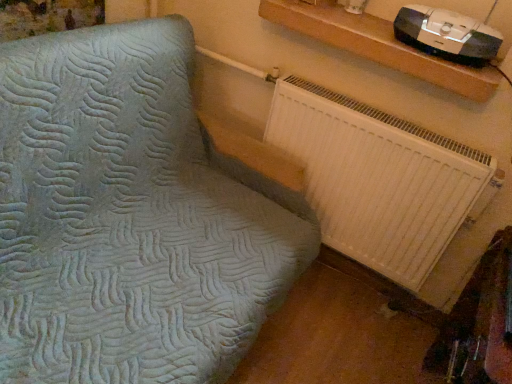
The width and height of the screenshot is (512, 384). What are the coordinates of `white plastic radiator at lower right` in the screenshot? It's located at tap(378, 179).

Locate an element on the screen. black plastic stereo at upper right is located at coordinates (447, 35).

Find the location of `white plastic radiator at lower right`. white plastic radiator at lower right is located at coordinates 378,179.

From a real-world perspective, is black plastic stereo at upper right positioned under wooden shelf at upper right based on gravity?

No, from a real-world perspective, black plastic stereo at upper right is not beneath wooden shelf at upper right.

Based on the photo, does black plastic stereo at upper right have a smaller size compared to wooden shelf at upper right?

Yes, black plastic stereo at upper right is smaller than wooden shelf at upper right.

Can you confirm if black plastic stereo at upper right is thinner than wooden shelf at upper right?

Indeed, black plastic stereo at upper right has a lesser width compared to wooden shelf at upper right.

Consider the image. Can you tell me how much black plastic stereo at upper right and wooden shelf at upper right differ in facing direction?

0.287 degrees.

The height and width of the screenshot is (384, 512). I want to click on stereo on the right side of wooden shelf at upper right, so click(447, 35).

Is point (305, 10) closer or farther from the camera than point (432, 35)?

Point (305, 10) is farther from the camera than point (432, 35).

From a real-world perspective, does wooden shelf at upper right sit lower than black plastic stereo at upper right?

Yes, from a real-world perspective, wooden shelf at upper right is beneath black plastic stereo at upper right.

Which is farther, (410, 37) or (382, 158)?

Positioned behind is point (382, 158).

At what (x,y) coordinates should I click in order to perform the action: click on radiator on the left of black plastic stereo at upper right. Please return your answer as a coordinate pair (x, y). The height and width of the screenshot is (384, 512). Looking at the image, I should click on (378, 179).

Does black plastic stereo at upper right appear on the right side of white plastic radiator at lower right?

Yes.

From the image's perspective, which is above, black plastic stereo at upper right or white plastic radiator at lower right?

From the image's view, black plastic stereo at upper right is above.

Is black plastic stereo at upper right located within white plastic radiator at lower right?

No, black plastic stereo at upper right is not inside white plastic radiator at lower right.

From their relative heights in the image, would you say white plastic radiator at lower right is taller or shorter than black plastic stereo at upper right?

white plastic radiator at lower right is taller than black plastic stereo at upper right.

Is white plastic radiator at lower right thinner than black plastic stereo at upper right?

Yes.

Which of these two, white plastic radiator at lower right or wooden shelf at upper right, is thinner?

Thinner between the two is white plastic radiator at lower right.

Considering their positions, is white plastic radiator at lower right located in front of or behind wooden shelf at upper right?

white plastic radiator at lower right is positioned farther from the viewer than wooden shelf at upper right.

How different are the orientations of white plastic radiator at lower right and wooden shelf at upper right in degrees?

A: The angular difference between white plastic radiator at lower right and wooden shelf at upper right is 0.32 degrees.

Could you tell me if white plastic radiator at lower right is turned towards wooden shelf at upper right?

No, white plastic radiator at lower right is not turned towards wooden shelf at upper right.

Based on the photo, is wooden shelf at upper right closer to camera compared to white plastic radiator at lower right?

Yes, the depth of wooden shelf at upper right is less than that of white plastic radiator at lower right.

Can you confirm if wooden shelf at upper right is positioned to the left of white plastic radiator at lower right?

No, wooden shelf at upper right is not to the left of white plastic radiator at lower right.

Are wooden shelf at upper right and white plastic radiator at lower right beside each other?

No, wooden shelf at upper right is not beside white plastic radiator at lower right.

The height and width of the screenshot is (384, 512). What are the coordinates of `shelf above the white plastic radiator at lower right (from a real-world perspective)` in the screenshot? It's located at 378,45.

Identify the location of stereo in front of the wooden shelf at upper right. This screenshot has height=384, width=512. (447, 35).

Where is `stereo located below the wooden shelf at upper right (from the image's perspective)`? stereo located below the wooden shelf at upper right (from the image's perspective) is located at coordinates (447, 35).

Which object lies nearer to the anchor point white plastic radiator at lower right, wooden shelf at upper right or black plastic stereo at upper right?

wooden shelf at upper right is closer to white plastic radiator at lower right.

From the image, which object appears to be farther from wooden shelf at upper right, white plastic radiator at lower right or black plastic stereo at upper right?

white plastic radiator at lower right.

Looking at the image, which one is located closer to wooden shelf at upper right, black plastic stereo at upper right or white plastic radiator at lower right?

black plastic stereo at upper right.

Looking at the image, which one is located further to black plastic stereo at upper right, wooden shelf at upper right or white plastic radiator at lower right?

white plastic radiator at lower right lies further to black plastic stereo at upper right than the other object.

Looking at the image, which one is located closer to white plastic radiator at lower right, black plastic stereo at upper right or wooden shelf at upper right?

wooden shelf at upper right.

Which object lies further to the anchor point black plastic stereo at upper right, white plastic radiator at lower right or wooden shelf at upper right?

Based on the image, white plastic radiator at lower right appears to be further to black plastic stereo at upper right.

Locate an element on the screen. The image size is (512, 384). stereo between wooden shelf at upper right and white plastic radiator at lower right from top to bottom is located at coordinates (447, 35).